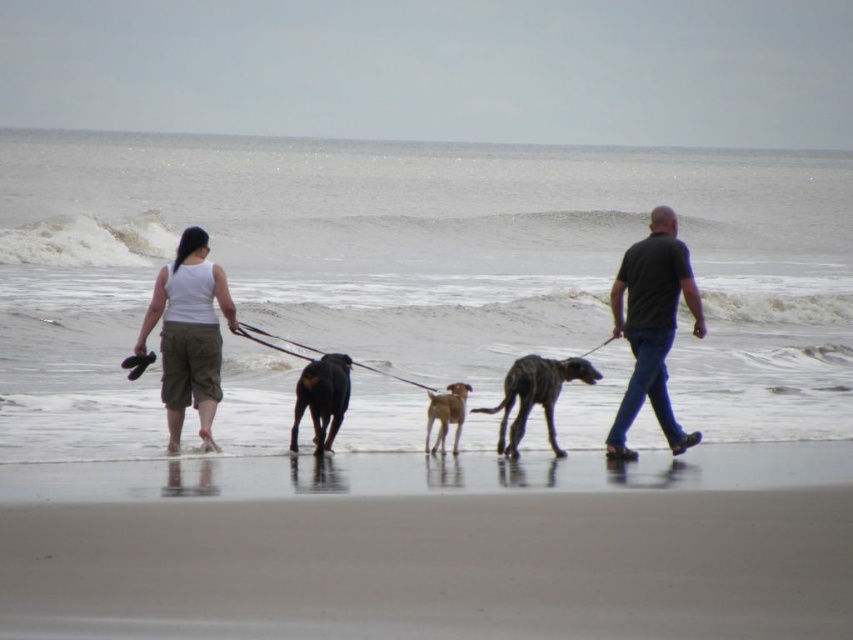
Is spotted fur dog at center positioned behind light brown fur at center?

That is False.

Which is in front, point (526, 362) or point (445, 432)?

Point (526, 362) is more forward.

Image resolution: width=853 pixels, height=640 pixels. I want to click on spotted fur dog at center, so coord(535,396).

Does smooth sand at lower center appear on the right side of light brown fur at center?

Indeed, smooth sand at lower center is positioned on the right side of light brown fur at center.

Which is behind, point (1, 516) or point (444, 433)?

Positioned behind is point (444, 433).

Is point (94, 604) closer to camera compared to point (440, 442)?

Yes, point (94, 604) is in front of point (440, 442).

The height and width of the screenshot is (640, 853). I want to click on smooth sand at lower center, so click(434, 545).

Which is below, black matte shirt at right or light brown fur at center?

light brown fur at center is lower down.

Between black matte shirt at right and light brown fur at center, which one has more height?

black matte shirt at right

Does point (633, 333) come closer to viewer compared to point (456, 436)?

Yes, point (633, 333) is closer to viewer.

This screenshot has width=853, height=640. What are the coordinates of `black matte shirt at right` in the screenshot? It's located at (653, 326).